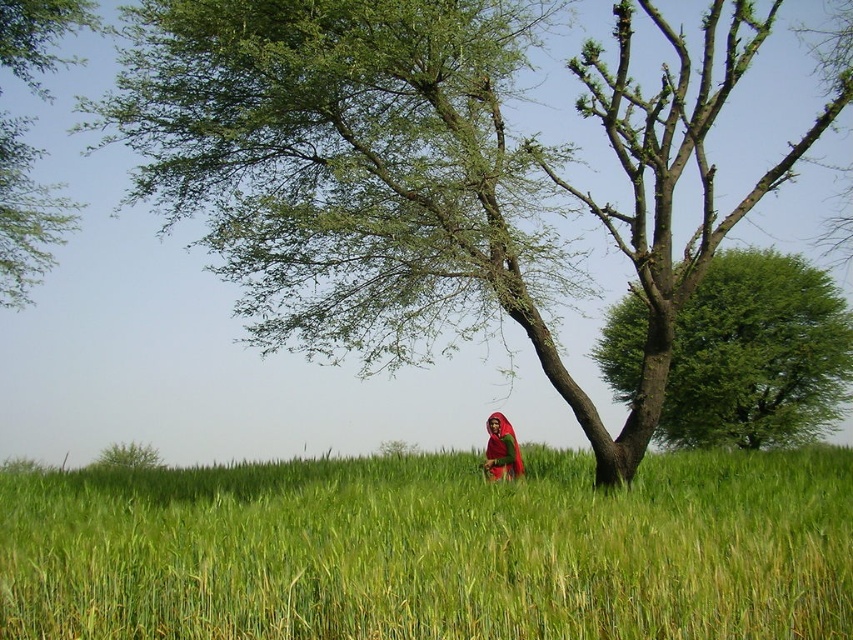
Question: Does green leafy tree at right have a larger size compared to green leafy tree at upper left?

Choices:
 (A) no
 (B) yes

Answer: (A)

Question: Which of the following is the closest to the observer?

Choices:
 (A) (509, 451)
 (B) (764, 308)
 (C) (18, 193)

Answer: (A)

Question: Which of the following is the closest to the observer?

Choices:
 (A) green leafy tree at right
 (B) matte red sari at center

Answer: (B)

Question: Does green leafy tree at center appear under matte red sari at center?

Choices:
 (A) no
 (B) yes

Answer: (A)

Question: Is green grassy field at center wider than green leafy tree at upper left?

Choices:
 (A) no
 (B) yes

Answer: (B)

Question: Which is farther from the green leafy tree at upper left?

Choices:
 (A) green leafy tree at right
 (B) matte red sari at center

Answer: (A)